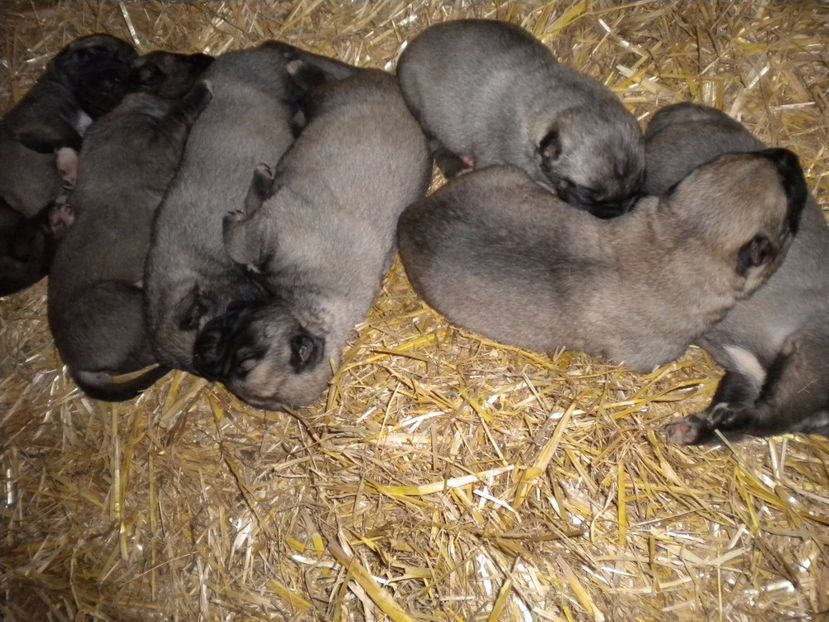
At what (x,y) coordinates should I click in order to perform the action: click on straw bed. Please return your answer as a coordinate pair (x, y). The image size is (829, 622). Looking at the image, I should click on (401, 476), (726, 511), (419, 350), (652, 73), (376, 26), (34, 320), (165, 438).